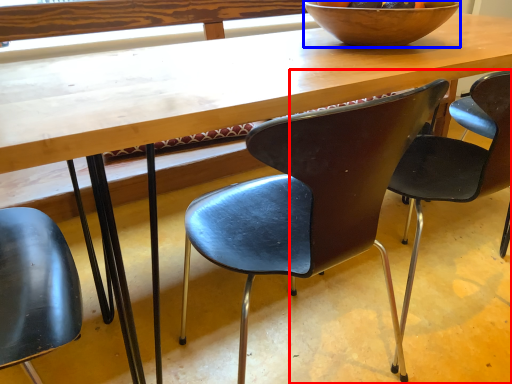
Question: Among these objects, which one is nearest to the camera, chair (highlighted by a red box) or bowl (highlighted by a blue box)?

Choices:
 (A) chair
 (B) bowl

Answer: (A)